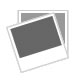
Identify the location of space under first photo window. (45, 63).